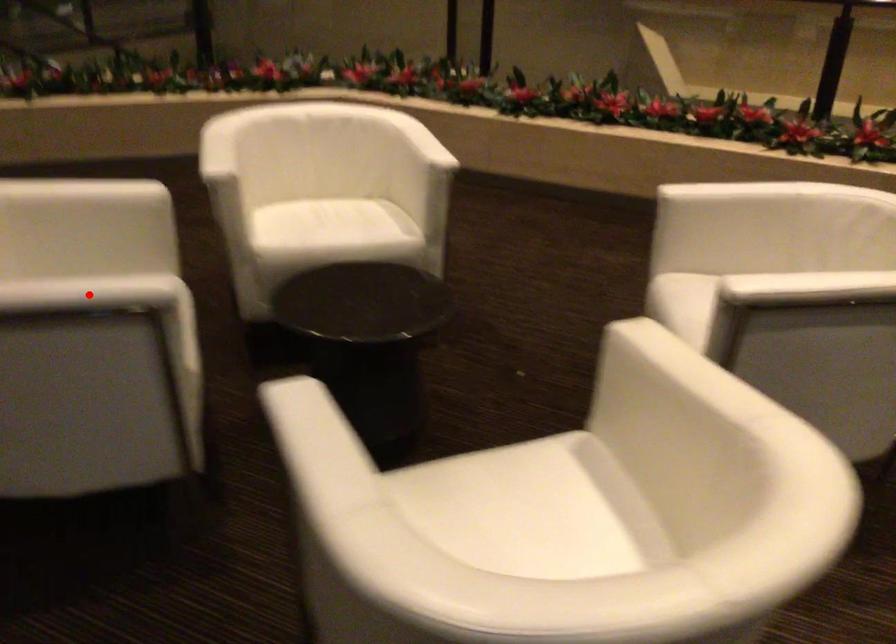
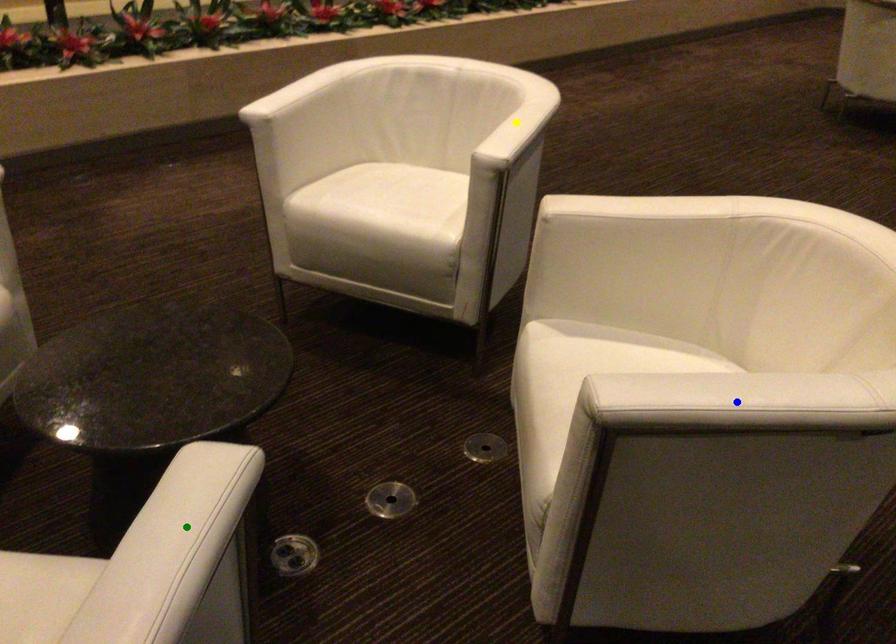
Question: I am providing you with two images of the same scene from different viewpoints. A red point is marked on the first image. You are given multiple points on the second image. Which point in image 2 represents the same 3d spot as the red point in image 1?

Choices:
 (A) yellow point
 (B) green point
 (C) blue point

Answer: (B)